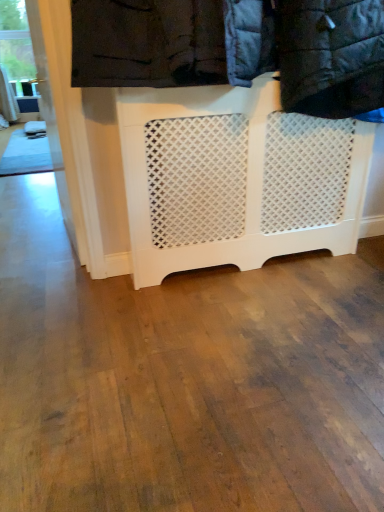
Question: Considering the relative sizes of clear glass window at upper left and white lattice laundry at upper center in the image provided, is clear glass window at upper left wider than white lattice laundry at upper center?

Choices:
 (A) yes
 (B) no

Answer: (B)

Question: Considering the relative sizes of clear glass window at upper left and white lattice laundry at upper center in the image provided, is clear glass window at upper left smaller than white lattice laundry at upper center?

Choices:
 (A) no
 (B) yes

Answer: (B)

Question: Considering the relative sizes of clear glass window at upper left and white lattice laundry at upper center in the image provided, is clear glass window at upper left thinner than white lattice laundry at upper center?

Choices:
 (A) no
 (B) yes

Answer: (B)

Question: Is clear glass window at upper left shorter than white lattice laundry at upper center?

Choices:
 (A) no
 (B) yes

Answer: (A)

Question: From a real-world perspective, is clear glass window at upper left physically above white lattice laundry at upper center?

Choices:
 (A) no
 (B) yes

Answer: (A)

Question: From the image's perspective, is white lattice laundry at upper center located above or below white lattice radiator at center?

Choices:
 (A) above
 (B) below

Answer: (A)

Question: From a real-world perspective, is white lattice laundry at upper center positioned above or below white lattice radiator at center?

Choices:
 (A) below
 (B) above

Answer: (B)

Question: In the image, is white lattice laundry at upper center positioned in front of or behind white lattice radiator at center?

Choices:
 (A) front
 (B) behind

Answer: (A)

Question: Based on their positions, is white lattice laundry at upper center located to the left or right of white lattice radiator at center?

Choices:
 (A) right
 (B) left

Answer: (A)

Question: Looking at their shapes, would you say clear glass window at upper left is wider or thinner than white lattice laundry at upper center?

Choices:
 (A) wide
 (B) thin

Answer: (B)

Question: Is clear glass window at upper left inside the boundaries of white lattice laundry at upper center, or outside?

Choices:
 (A) outside
 (B) inside

Answer: (A)

Question: In the image, is clear glass window at upper left on the left side or the right side of white lattice laundry at upper center?

Choices:
 (A) left
 (B) right

Answer: (A)

Question: Considering their positions, is clear glass window at upper left located in front of or behind white lattice laundry at upper center?

Choices:
 (A) front
 (B) behind

Answer: (B)

Question: Does point (246, 246) appear closer or farther from the camera than point (241, 66)?

Choices:
 (A) closer
 (B) farther

Answer: (B)

Question: From the image's perspective, is white lattice radiator at center located above or below white lattice laundry at upper center?

Choices:
 (A) above
 (B) below

Answer: (B)